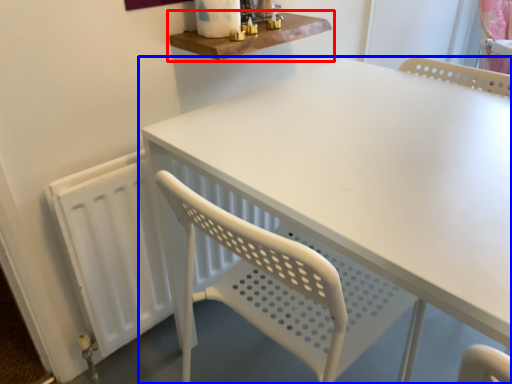
Question: Which object is closer to the camera taking this photo, shelf (highlighted by a red box) or table (highlighted by a blue box)?

Choices:
 (A) shelf
 (B) table

Answer: (B)